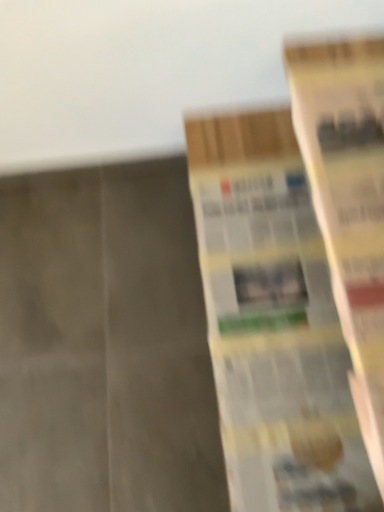
Question: Is yellow paper book at right, which ranks as the second book in left-to-right order, facing towards yellow paper book at right, placed as the 1th book when sorted from left to right?

Choices:
 (A) yes
 (B) no

Answer: (B)

Question: From a real-world perspective, is yellow paper book at right, which ranks as the second book in left-to-right order, below yellow paper book at right, which is the second book in right-to-left order?

Choices:
 (A) no
 (B) yes

Answer: (A)

Question: Is yellow paper book at right, which ranks as the second book in left-to-right order, bigger than yellow paper book at right, placed as the 1th book when sorted from left to right?

Choices:
 (A) yes
 (B) no

Answer: (B)

Question: Is yellow paper book at right, which ranks as the second book in left-to-right order, wider than yellow paper book at right, placed as the 1th book when sorted from left to right?

Choices:
 (A) no
 (B) yes

Answer: (A)

Question: Considering the relative sizes of yellow paper book at right, the 1th book when ordered from right to left, and yellow paper book at right, which is the second book in right-to-left order, in the image provided, is yellow paper book at right, the 1th book when ordered from right to left, smaller than yellow paper book at right, which is the second book in right-to-left order,?

Choices:
 (A) yes
 (B) no

Answer: (A)

Question: Is yellow paper book at right, which ranks as the second book in left-to-right order, further to camera compared to yellow paper book at right, which is the second book in right-to-left order?

Choices:
 (A) no
 (B) yes

Answer: (A)

Question: Is yellow paper book at right, which is the second book in right-to-left order, positioned far away from yellow paper book at right, the 1th book when ordered from right to left?

Choices:
 (A) no
 (B) yes

Answer: (A)

Question: Is yellow paper book at right, which is the second book in right-to-left order, positioned in front of yellow paper book at right, the 1th book when ordered from right to left?

Choices:
 (A) yes
 (B) no

Answer: (B)

Question: Is yellow paper book at right, placed as the 1th book when sorted from left to right, at the right side of yellow paper book at right, which ranks as the second book in left-to-right order?

Choices:
 (A) no
 (B) yes

Answer: (A)

Question: Does yellow paper book at right, which is the second book in right-to-left order, have a smaller size compared to yellow paper book at right, the 1th book when ordered from right to left?

Choices:
 (A) no
 (B) yes

Answer: (A)

Question: Is yellow paper book at right, placed as the 1th book when sorted from left to right, bigger than yellow paper book at right, the 1th book when ordered from right to left?

Choices:
 (A) no
 (B) yes

Answer: (B)

Question: Considering the relative sizes of yellow paper book at right, which is the second book in right-to-left order, and yellow paper book at right, the 1th book when ordered from right to left, in the image provided, is yellow paper book at right, which is the second book in right-to-left order, shorter than yellow paper book at right, the 1th book when ordered from right to left,?

Choices:
 (A) no
 (B) yes

Answer: (A)

Question: In the image, is yellow paper book at right, placed as the 1th book when sorted from left to right, positioned in front of or behind yellow paper book at right, the 1th book when ordered from right to left?

Choices:
 (A) behind
 (B) front

Answer: (A)